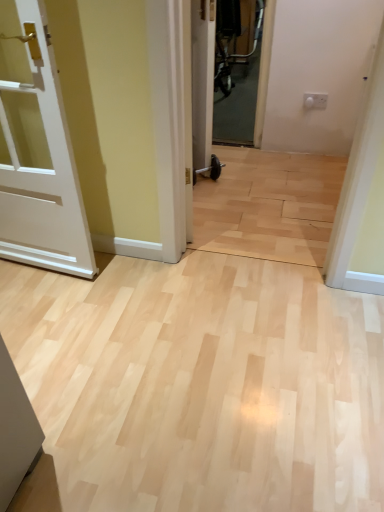
What are the coordinates of `blank area beneath white matte door at left, the second door in the back-to-front sequence (from a real-world perspective)` in the screenshot? It's located at (x=62, y=308).